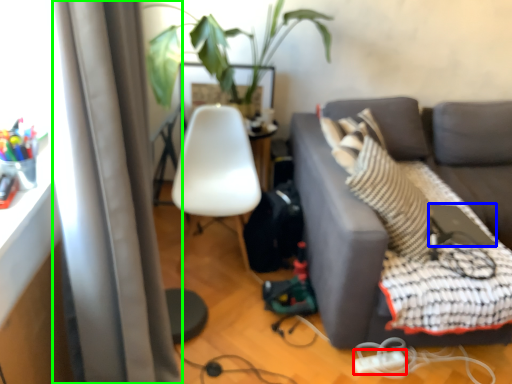
Question: Based on their relative distances, which object is farther from extension cord (highlighted by a red box)? Choose from computer (highlighted by a blue box) and curtain (highlighted by a green box).

Choices:
 (A) computer
 (B) curtain

Answer: (B)